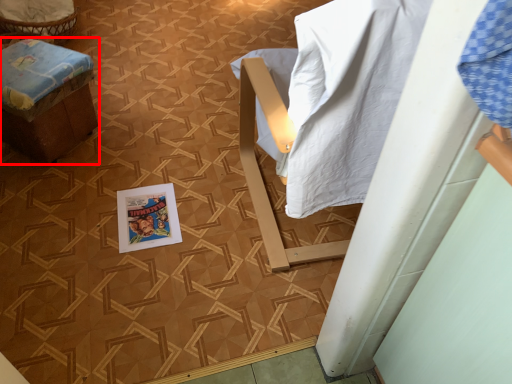
Question: From the image's perspective, what is the correct spatial positioning of furniture (annotated by the red box) in reference to comic book?

Choices:
 (A) below
 (B) above

Answer: (B)